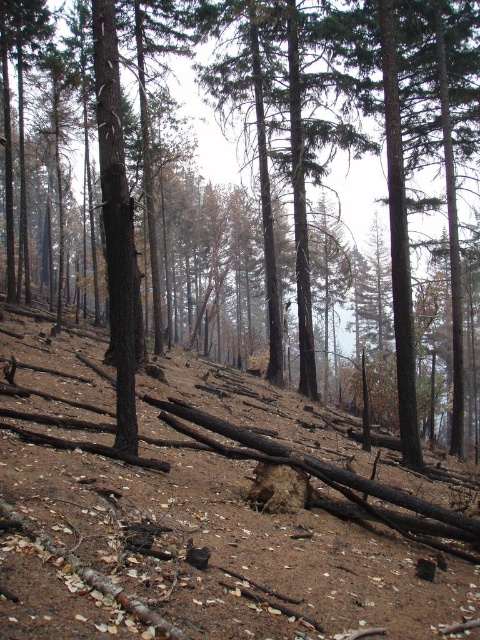
You are a drone operator trying to assess the disaster area. You notice two points in the image at coordinates point (4,488) and point (407,403). Which point is nearer to the camera?

Point (4,488) is closer to the camera than point (407,403).

Looking at this image, you are a drone operator trying to map the disaster area. Your drone is currently hovering at the center of the image. You need to drop a marker at the exact location of the brown dirt at center. What are the coordinates where you should drop the marker?

The coordinates for the brown dirt at center are at point (x=208, y=515).